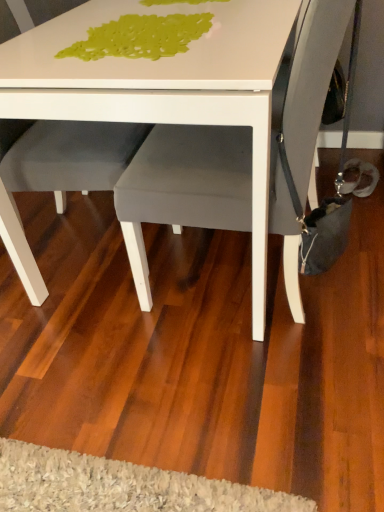
What do you see at coordinates (184, 187) in the screenshot?
I see `matte gray cushion at center` at bounding box center [184, 187].

Measure the distance between point (198, 151) and camera.

Point (198, 151) and camera are 4.01 feet apart.

Find the location of a particular element. matte gray cushion at center is located at coordinates (184, 187).

Where is `matte gray cushion at center`? matte gray cushion at center is located at coordinates (184, 187).